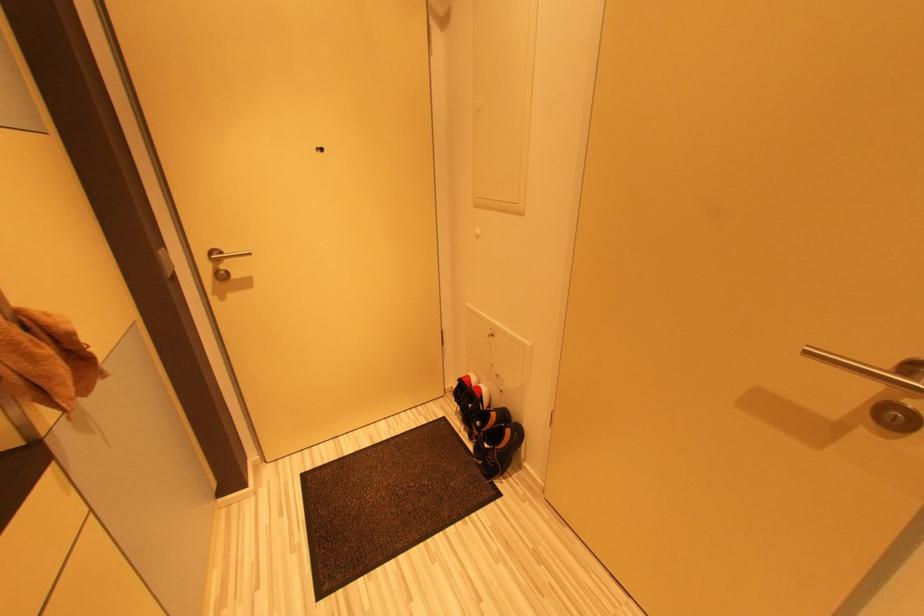
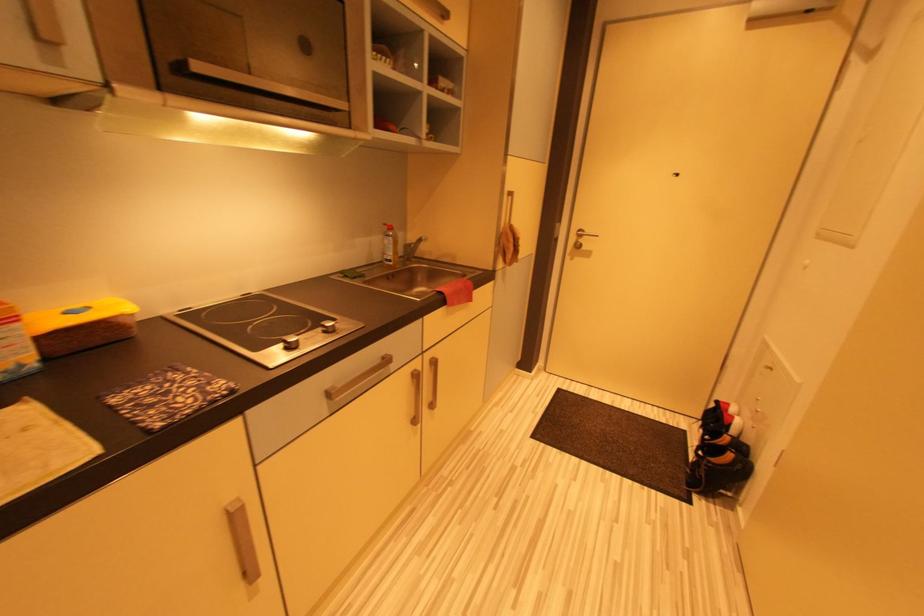
Question: The first image is from the beginning of the video and the second image is from the end. How did the camera likely rotate when shooting the video?

Choices:
 (A) Left
 (B) Right
 (C) Up
 (D) Down

Answer: (A)